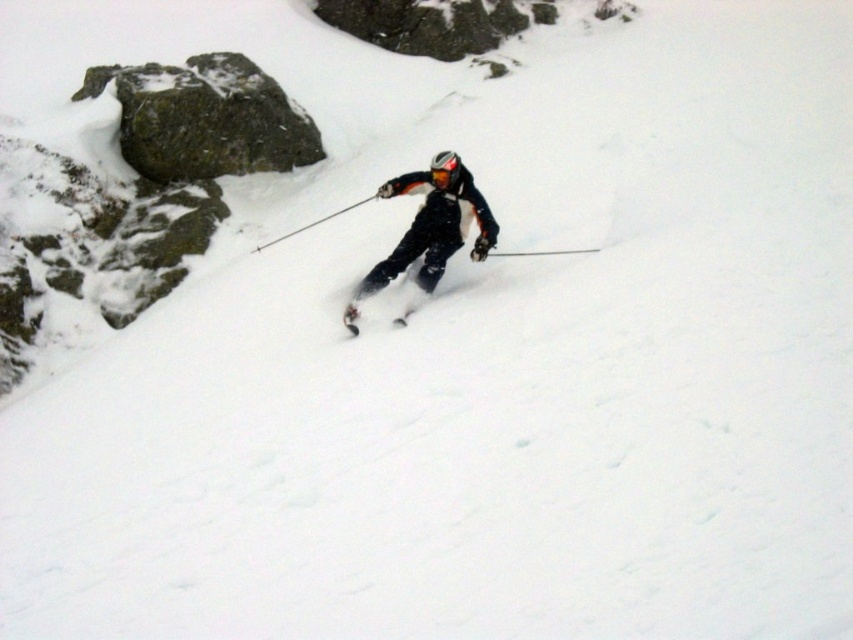
You are a ski equipment inspector checking the equipment of a skier. You notice the matte black ski at center and the metallic ski pole at center. Which object has a smaller width?

The matte black ski at center is thinner than the metallic ski pole at center, so the matte black ski at center has a smaller width.

You are a skier who wants to retrieve your metallic ski pole at center from the slope. You are currently standing at the base of the slope where the matte black ski at center is located. Can you reach the pole without moving more than 3 meters?

The distance between the matte black ski at center and the metallic ski pole at center is 3.63 meters, so you cannot reach the pole without moving more than 3 meters.